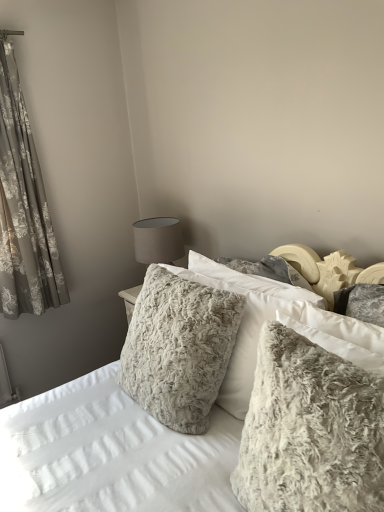
Question: Considering the relative sizes of floral-patterned fabric at left and fuzzy white pillow at center, the first pillow when ordered from back to front, in the image provided, is floral-patterned fabric at left taller than fuzzy white pillow at center, the first pillow when ordered from back to front,?

Choices:
 (A) yes
 (B) no

Answer: (A)

Question: Considering the relative sizes of floral-patterned fabric at left and fuzzy white pillow at center, the first pillow when ordered from back to front, in the image provided, is floral-patterned fabric at left smaller than fuzzy white pillow at center, the first pillow when ordered from back to front,?

Choices:
 (A) no
 (B) yes

Answer: (B)

Question: Is floral-patterned fabric at left shorter than fuzzy white pillow at center, the first pillow when ordered from back to front?

Choices:
 (A) no
 (B) yes

Answer: (A)

Question: Is floral-patterned fabric at left far away from fuzzy white pillow at center, the 2th pillow from the front?

Choices:
 (A) yes
 (B) no

Answer: (A)

Question: Does floral-patterned fabric at left appear on the left side of fuzzy white pillow at center, the 2th pillow from the front?

Choices:
 (A) no
 (B) yes

Answer: (B)

Question: Is fuzzy white pillow at center, the 2th pillow from the front, bigger or smaller than floral-patterned fabric at left?

Choices:
 (A) small
 (B) big

Answer: (B)

Question: Would you say fuzzy white pillow at center, the 2th pillow from the front, is to the left or to the right of floral-patterned fabric at left in the picture?

Choices:
 (A) right
 (B) left

Answer: (A)

Question: In terms of width, does fuzzy white pillow at center, the first pillow when ordered from back to front, look wider or thinner when compared to floral-patterned fabric at left?

Choices:
 (A) thin
 (B) wide

Answer: (B)

Question: Is fuzzy white pillow at center, the 2th pillow from the front, in front of or behind floral-patterned fabric at left in the image?

Choices:
 (A) behind
 (B) front

Answer: (B)

Question: Is fuzzy gray pillow at center situated inside fuzzy white pillow at center, the first pillow when ordered from back to front, or outside?

Choices:
 (A) outside
 (B) inside

Answer: (A)

Question: Considering the positions of point (213, 502) and point (215, 338), is point (213, 502) closer or farther from the camera than point (215, 338)?

Choices:
 (A) closer
 (B) farther

Answer: (A)

Question: Considering their positions, is fuzzy gray pillow at center located in front of or behind fuzzy white pillow at center, the first pillow when ordered from back to front?

Choices:
 (A) front
 (B) behind

Answer: (A)

Question: Looking at their shapes, would you say fuzzy gray pillow at center is wider or thinner than fuzzy white pillow at center, the 2th pillow from the front?

Choices:
 (A) wide
 (B) thin

Answer: (A)

Question: From a real-world perspective, is floral-patterned fabric at left positioned above or below fuzzy white pillow at center, the first pillow when ordered from back to front?

Choices:
 (A) below
 (B) above

Answer: (B)

Question: Would you say floral-patterned fabric at left is inside or outside fuzzy white pillow at center, the 2th pillow from the front?

Choices:
 (A) inside
 (B) outside

Answer: (B)